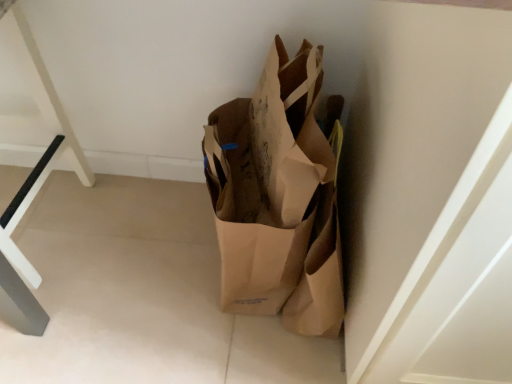
Describe the element at coordinates (33, 169) in the screenshot. I see `white plastic table at left` at that location.

Where is `white plastic table at left`? white plastic table at left is located at coordinates (33, 169).

Describe the element at coordinates (279, 197) in the screenshot. I see `brown paper bag at center` at that location.

This screenshot has height=384, width=512. I want to click on brown paper bag at center, so click(279, 197).

Identify the location of white plastic table at left. (33, 169).

Considering the relative positions of white plastic table at left and brown paper bag at center in the image provided, is white plastic table at left to the left of brown paper bag at center from the viewer's perspective?

Yes, white plastic table at left is to the left of brown paper bag at center.

Does white plastic table at left lie in front of brown paper bag at center?

No, it is behind brown paper bag at center.

Does point (20, 286) come farther from viewer compared to point (230, 131)?

No.

From the image's perspective, is white plastic table at left on brown paper bag at center?

Yes, from the image's perspective, white plastic table at left is over brown paper bag at center.

From a real-world perspective, which is physically below, white plastic table at left or brown paper bag at center?

brown paper bag at center.

Is white plastic table at left thinner than brown paper bag at center?

Indeed, white plastic table at left has a lesser width compared to brown paper bag at center.

Between white plastic table at left and brown paper bag at center, which one has less height?

white plastic table at left.

Which of these two, white plastic table at left or brown paper bag at center, is smaller?

white plastic table at left.

Is white plastic table at left not inside brown paper bag at center?

white plastic table at left lies outside brown paper bag at center's area.

Is white plastic table at left not near brown paper bag at center?

No.

Is white plastic table at left turned away from brown paper bag at center?

white plastic table at left is not turned away from brown paper bag at center.

Can you tell me how much white plastic table at left and brown paper bag at center differ in facing direction?

The angle between the facing direction of white plastic table at left and the facing direction of brown paper bag at center is 89.5 degrees.

How far apart are white plastic table at left and brown paper bag at center?

They are 20.68 inches apart.

The height and width of the screenshot is (384, 512). I want to click on furniture above the brown paper bag at center (from a real-world perspective), so click(x=33, y=169).

Looking at this image, is brown paper bag at center to the right of white plastic table at left from the viewer's perspective?

Yes.

Does brown paper bag at center lie behind white plastic table at left?

No.

Considering the positions of points (341, 313) and (55, 127), is point (341, 313) farther from camera compared to point (55, 127)?

No, (341, 313) is closer to viewer.

From the image's perspective, does brown paper bag at center appear lower than white plastic table at left?

Yes, from the image's perspective, brown paper bag at center is below white plastic table at left.

From a real-world perspective, between brown paper bag at center and white plastic table at left, who is vertically lower?

brown paper bag at center, from a real-world perspective.

Considering the relative sizes of brown paper bag at center and white plastic table at left in the image provided, is brown paper bag at center wider than white plastic table at left?

Correct, the width of brown paper bag at center exceeds that of white plastic table at left.

Considering the sizes of brown paper bag at center and white plastic table at left in the image, is brown paper bag at center taller or shorter than white plastic table at left?

Considering their sizes, brown paper bag at center has more height than white plastic table at left.

Does brown paper bag at center have a smaller size compared to white plastic table at left?

Incorrect, brown paper bag at center is not smaller in size than white plastic table at left.

Would you say white plastic table at left is part of brown paper bag at center's contents?

Actually, white plastic table at left is outside brown paper bag at center.

Is brown paper bag at center positioned far away from white plastic table at left?

Result: No, brown paper bag at center is in close proximity to white plastic table at left.

Does brown paper bag at center turn towards white plastic table at left?

No, brown paper bag at center is not oriented towards white plastic table at left.

What's the angular difference between brown paper bag at center and white plastic table at left's facing directions?

89.5 degrees separate the facing orientations of brown paper bag at center and white plastic table at left.

Image resolution: width=512 pixels, height=384 pixels. Identify the location of grocery bag lying on the right of white plastic table at left. (279, 197).

Where is `grocery bag lying on the right of white plastic table at left`? grocery bag lying on the right of white plastic table at left is located at coordinates (279, 197).

This screenshot has width=512, height=384. I want to click on furniture behind the brown paper bag at center, so click(33, 169).